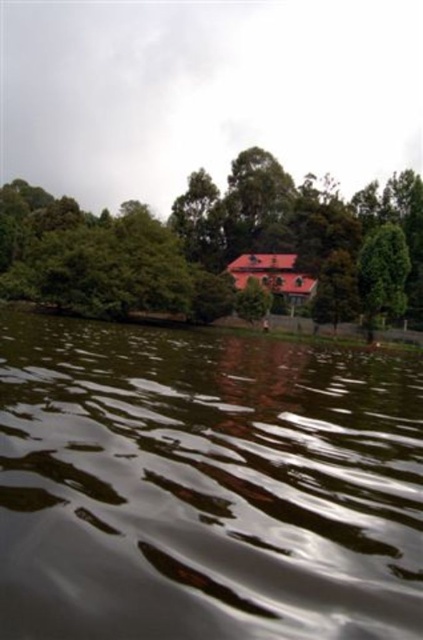
Which is below, dark reflective water at center or green leafy tree at upper center?

Positioned lower is dark reflective water at center.

Is dark reflective water at center wider than green leafy tree at upper center?

No, dark reflective water at center is not wider than green leafy tree at upper center.

Is point (43, 440) closer to camera compared to point (415, 244)?

That is True.

At what (x,y) coordinates should I click in order to perform the action: click on dark reflective water at center. Please return your answer as a coordinate pair (x, y). Looking at the image, I should click on (205, 486).